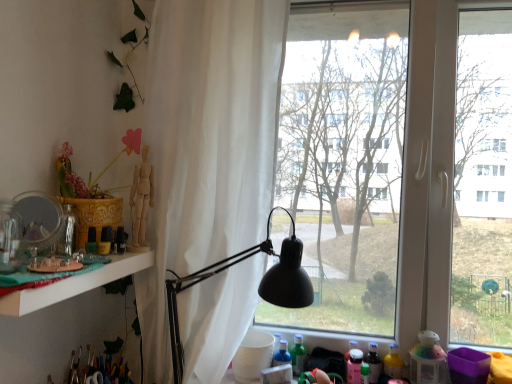
Question: Considering the relative positions of transparent glass window at center and translucent plastic bottle at lower right, the first bottle from the right, in the image provided, is transparent glass window at center to the left of translucent plastic bottle at lower right, the first bottle from the right, from the viewer's perspective?

Choices:
 (A) yes
 (B) no

Answer: (B)

Question: Is transparent glass window at center outside translucent plastic bottle at lower right, the 2th bottle from the left?

Choices:
 (A) yes
 (B) no

Answer: (A)

Question: Is transparent glass window at center looking in the opposite direction of translucent plastic bottle at lower right, the first bottle from the right?

Choices:
 (A) no
 (B) yes

Answer: (B)

Question: Can you confirm if transparent glass window at center is smaller than translucent plastic bottle at lower right, the 2th bottle from the left?

Choices:
 (A) no
 (B) yes

Answer: (A)

Question: Does transparent glass window at center have a lesser width compared to translucent plastic bottle at lower right, the 2th bottle from the left?

Choices:
 (A) no
 (B) yes

Answer: (A)

Question: Is point (125, 253) closer or farther from the camera than point (266, 243)?

Choices:
 (A) closer
 (B) farther

Answer: (A)

Question: Is white glossy shelf at left wider or thinner than black matte lamp at center?

Choices:
 (A) wide
 (B) thin

Answer: (B)

Question: From a real-world perspective, is white glossy shelf at left above or below black matte lamp at center?

Choices:
 (A) above
 (B) below

Answer: (A)

Question: In the image, is white glossy shelf at left on the left side or the right side of black matte lamp at center?

Choices:
 (A) right
 (B) left

Answer: (B)

Question: Considering their positions, is white sheer curtain at center located in front of or behind black matte lamp at center?

Choices:
 (A) behind
 (B) front

Answer: (A)

Question: Is white sheer curtain at center wider or thinner than black matte lamp at center?

Choices:
 (A) thin
 (B) wide

Answer: (A)

Question: Is white sheer curtain at center inside the boundaries of black matte lamp at center, or outside?

Choices:
 (A) outside
 (B) inside

Answer: (A)

Question: In the image, is white sheer curtain at center on the left side or the right side of black matte lamp at center?

Choices:
 (A) left
 (B) right

Answer: (A)

Question: From a real-world perspective, is green matte bottle at lower center, placed as the 1th bottle when sorted from left to right, positioned above or below wooden mannequin at left?

Choices:
 (A) below
 (B) above

Answer: (A)

Question: In the image, is green matte bottle at lower center, placed as the 1th bottle when sorted from left to right, on the left side or the right side of wooden mannequin at left?

Choices:
 (A) right
 (B) left

Answer: (A)